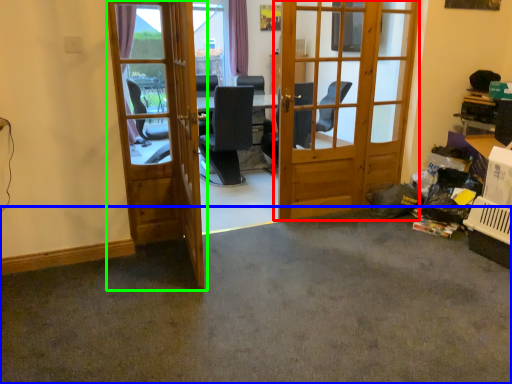
Question: Which is nearer to the door (highlighted by a red box)? concrete (highlighted by a blue box) or door (highlighted by a green box).

Choices:
 (A) concrete
 (B) door

Answer: (B)